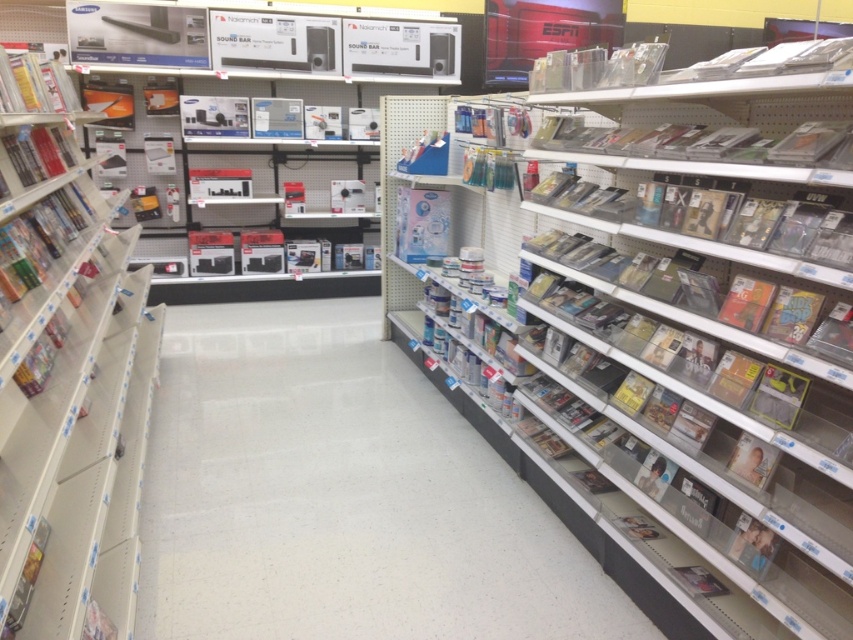
Who is positioned more to the right, clear plastic books at center or metallic silver bookshelf at left?

clear plastic books at center

Who is shorter, clear plastic books at center or metallic silver bookshelf at left?

Standing shorter between the two is metallic silver bookshelf at left.

Between point (811, 429) and point (45, 67), which one is positioned in front?

Point (811, 429) is more forward.

The image size is (853, 640). What are the coordinates of `clear plastic books at center` in the screenshot? It's located at (685, 324).

I want to click on clear plastic books at center, so click(685, 324).

Does clear plastic books at center have a greater width compared to white glossy floor at center?

No.

Where is `clear plastic books at center`? The image size is (853, 640). clear plastic books at center is located at coordinates (685, 324).

Between point (326, 550) and point (119, 353), which one is positioned in front?

Point (326, 550)

Where is `white glossy floor at center`? This screenshot has height=640, width=853. white glossy floor at center is located at coordinates (340, 497).

Is point (236, 589) farther from camera compared to point (100, 563)?

Yes.

Identify the location of white glossy floor at center. The width and height of the screenshot is (853, 640). (340, 497).